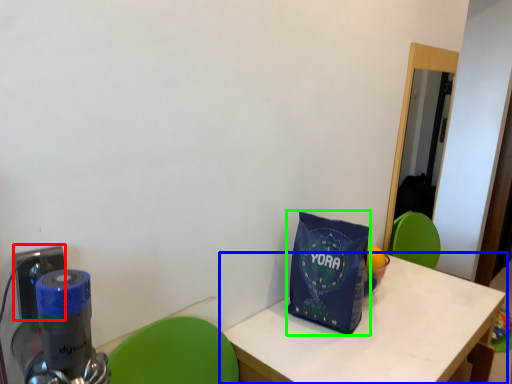
Question: Considering the real-world distances, which object is closest to electric outlet (highlighted by a red box)? table (highlighted by a blue box) or tote bag (highlighted by a green box).

Choices:
 (A) table
 (B) tote bag

Answer: (B)